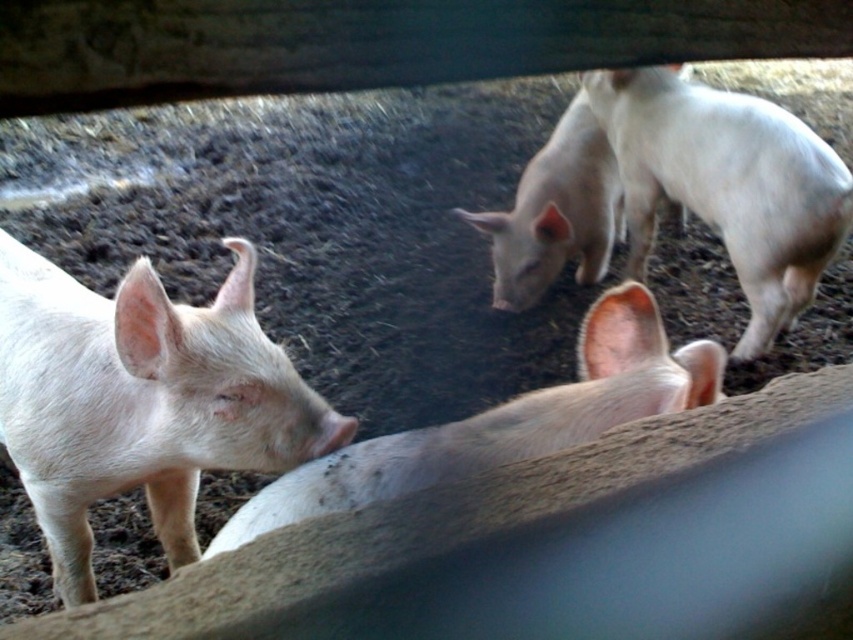
You are standing at the camera position and want to throw a small treat to the white matte pig at upper right. If your throwing range is up to 2 meters, will you be able to reach it?

The white matte pig at upper right is 2.38 meters away from the camera, which is beyond your throwing range of 2 meters. You won there.

You are standing at the center of the image. Which direction should you move to reach the white matte pig at left?

The white matte pig at left is located at point coordinates of 0.627 on the x axis and 0.166 on the y axis. Since you are at the center of the image, you should move to the left and slightly downward to reach it.